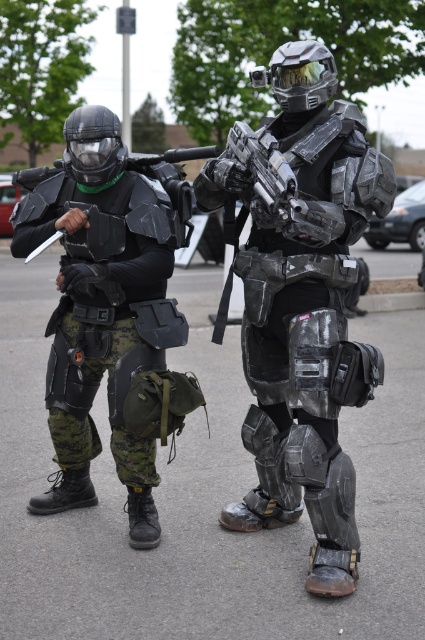
Based on the photo, you are a security guard in a high tech facility. You see the matte black armor at left and the shiny metallic gun at center. According to the security protocol, you must ensure that no unauthorized weapons are near restricted areas. Which object should you prioritize checking first based on their positions?

The shiny metallic gun at center should be prioritized for checking first because the matte black armor at left is positioned under it, meaning the gun is closer to the restricted area and requires immediate attention.

You are a photographer trying to capture a closeup shot of the futuristic armor details. You have two points of interest marked in the image at coordinates point (x=311, y=422) and point (x=90, y=212). Which point will appear larger in your photo?

Point (x=311, y=422) is closer to the camera than point (x=90, y=212), so it will appear larger in the photo.

You are navigating a virtual reality game and need to determine the position of the matte black armor at left relative to the center of the image. Is it closer to the top or bottom half of the image?

The matte black armor at left is located at point 0.242 on the vertical axis, which places it in the bottom half of the image.